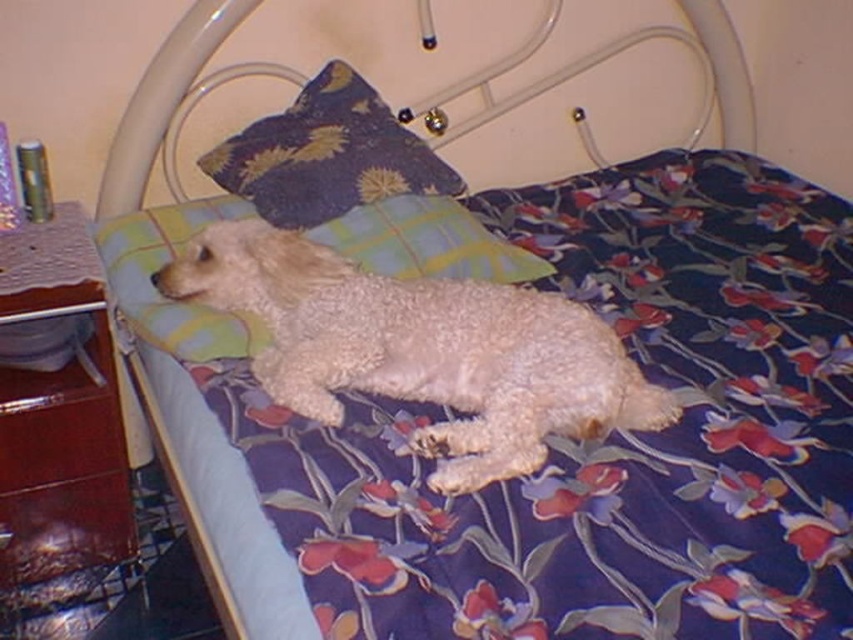
Question: Is white fluffy dog at center below green plaid pillow at upper center?

Choices:
 (A) no
 (B) yes

Answer: (B)

Question: Can you confirm if white fluffy dog at center is smaller than dark blue fabric pillow at upper center?

Choices:
 (A) no
 (B) yes

Answer: (A)

Question: Which point is closer to the camera?

Choices:
 (A) dark blue fabric pillow at upper center
 (B) white fluffy dog at center
 (C) green plaid pillow at upper center

Answer: (B)

Question: In this image, where is white fluffy dog at center located relative to dark blue fabric pillow at upper center?

Choices:
 (A) left
 (B) right

Answer: (B)

Question: Which of the following is the closest to the observer?

Choices:
 (A) pyautogui.click(x=506, y=339)
 (B) pyautogui.click(x=126, y=280)

Answer: (A)

Question: Which object is positioned closest to the green plaid pillow at upper center?

Choices:
 (A) dark blue fabric pillow at upper center
 (B) white fluffy dog at center

Answer: (A)